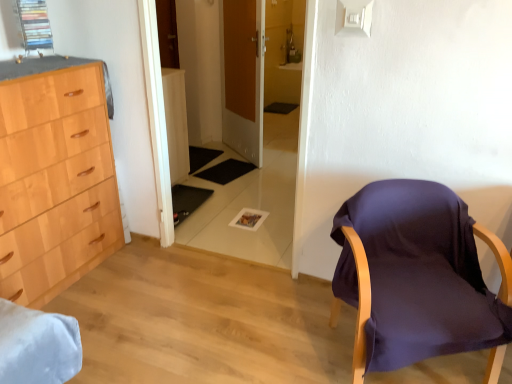
Locate an element on the screen. This screenshot has width=512, height=384. purple fabric chair at right is located at coordinates (416, 274).

Is purple fabric chair at right aimed at transparent glass door at center?

No, purple fabric chair at right does not turn towards transparent glass door at center.

From a real-world perspective, is purple fabric chair at right above or below transparent glass door at center?

Clearly, from a real-world perspective, purple fabric chair at right is below transparent glass door at center.

Would you say purple fabric chair at right is inside or outside transparent glass door at center?

purple fabric chair at right is spatially situated outside transparent glass door at center.

From a real-world perspective, is wooden door at center positioned above or below purple fabric chair at right?

Clearly, from a real-world perspective, wooden door at center is above purple fabric chair at right.

From the image's perspective, which is below, wooden door at center or purple fabric chair at right?

From the image's view, purple fabric chair at right is below.

Can you confirm if wooden door at center is positioned to the right of purple fabric chair at right?

In fact, wooden door at center is to the left of purple fabric chair at right.

From a real-world perspective, who is located higher, purple fabric chair at right or wooden door at center?

wooden door at center is physically above.

Does purple fabric chair at right turn towards wooden door at center?

No, purple fabric chair at right is not aimed at wooden door at center.

From the image's perspective, is purple fabric chair at right located above wooden door at center?

Actually, purple fabric chair at right appears below wooden door at center in the image.

Is transparent glass door at center with wooden door at center?

transparent glass door at center and wooden door at center are not in contact.

From a real-world perspective, between transparent glass door at center and wooden door at center, who is vertically lower?

transparent glass door at center.

In terms of height, does transparent glass door at center look taller or shorter compared to wooden door at center?

Clearly, transparent glass door at center is taller compared to wooden door at center.

Considering the sizes of objects transparent glass door at center and wooden door at center in the image provided, who is smaller, transparent glass door at center or wooden door at center?

transparent glass door at center.

Considering the positions of point (211, 139) and point (441, 208), is point (211, 139) closer or farther from the camera than point (441, 208)?

Point (211, 139) is farther from the camera than point (441, 208).

Between transparent glass door at center and purple fabric chair at right, which one has larger width?

With larger width is purple fabric chair at right.

Considering the positions of objects transparent glass door at center and purple fabric chair at right in the image provided, who is more to the right, transparent glass door at center or purple fabric chair at right?

Positioned to the right is purple fabric chair at right.

Looking at this image, from a real-world perspective, who is located higher, transparent glass door at center or purple fabric chair at right?

transparent glass door at center, from a real-world perspective.

Does wooden door at center have a lesser height compared to transparent glass door at center?

Correct, wooden door at center is not as tall as transparent glass door at center.

Where is `door that appears behind the transparent glass door at center`? The height and width of the screenshot is (384, 512). door that appears behind the transparent glass door at center is located at coordinates (243, 77).

Does wooden door at center come behind transparent glass door at center?

Yes.

From the picture: From a real-world perspective, is wooden door at center below transparent glass door at center?

Incorrect, from a real-world perspective, wooden door at center is higher than transparent glass door at center.

Where is `glass door above the purple fabric chair at right (from a real-world perspective)`? glass door above the purple fabric chair at right (from a real-world perspective) is located at coordinates (224, 71).

Find the location of a particular element. This screenshot has height=384, width=512. door behind the purple fabric chair at right is located at coordinates (243, 77).

Looking at the image, which one is located further to wooden door at center, purple fabric chair at right or transparent glass door at center?

purple fabric chair at right is positioned further to the anchor wooden door at center.

Which object lies further to the anchor point transparent glass door at center, wooden door at center or purple fabric chair at right?

purple fabric chair at right.

In the scene shown: Based on their spatial positions, is transparent glass door at center or purple fabric chair at right closer to wooden door at center?

transparent glass door at center is closer to wooden door at center.

Which object lies nearer to the anchor point transparent glass door at center, purple fabric chair at right or wooden door at center?

Among the two, wooden door at center is located nearer to transparent glass door at center.

From the image, which object appears to be farther from purple fabric chair at right, transparent glass door at center or wooden door at center?

transparent glass door at center.

Which object lies nearer to the anchor point purple fabric chair at right, wooden door at center or transparent glass door at center?

wooden door at center.

Identify the location of glass door located between purple fabric chair at right and wooden door at center in the depth direction. Image resolution: width=512 pixels, height=384 pixels. (224, 71).